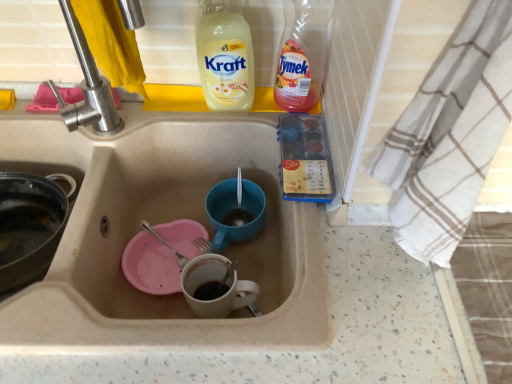
The width and height of the screenshot is (512, 384). Find the location of `vacant region to the left of yellow liquid soap at upper center`. vacant region to the left of yellow liquid soap at upper center is located at coordinates (139, 122).